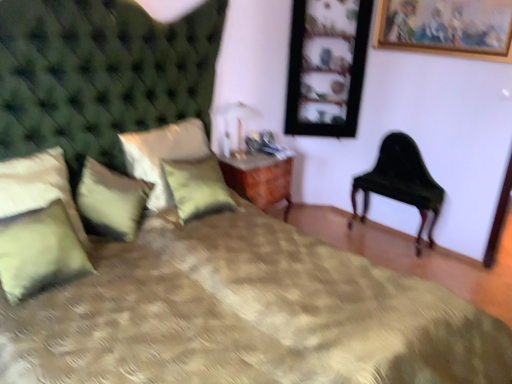
Question: Is gold-framed picture at upper right, the second picture frame when ordered from left to right, next to green textured pillow at center, which appears as the second pillow when viewed from the right, and touching it?

Choices:
 (A) no
 (B) yes

Answer: (A)

Question: Is gold-framed picture at upper right, placed as the first picture frame when sorted from front to back, positioned in front of green textured pillow at center, placed as the 4th pillow when sorted from left to right?

Choices:
 (A) no
 (B) yes

Answer: (A)

Question: From a real-world perspective, does gold-framed picture at upper right, the 1th picture frame from the right, stand above green textured pillow at center, placed as the 4th pillow when sorted from left to right?

Choices:
 (A) yes
 (B) no

Answer: (A)

Question: From the image's perspective, is gold-framed picture at upper right, the 1th picture frame from the right, over green textured pillow at center, placed as the 4th pillow when sorted from left to right?

Choices:
 (A) no
 (B) yes

Answer: (B)

Question: Can you confirm if gold-framed picture at upper right, the second picture frame when ordered from left to right, is positioned to the right of green textured pillow at center, which appears as the second pillow when viewed from the right?

Choices:
 (A) yes
 (B) no

Answer: (A)

Question: Considering the relative sizes of gold-framed picture at upper right, placed as the first picture frame when sorted from front to back, and green textured pillow at center, which appears as the second pillow when viewed from the right, in the image provided, is gold-framed picture at upper right, placed as the first picture frame when sorted from front to back, thinner than green textured pillow at center, which appears as the second pillow when viewed from the right,?

Choices:
 (A) yes
 (B) no

Answer: (A)

Question: Is green velvet pillow at left, which is the third pillow from right to left, next to green textured pillow at center, arranged as the 1th pillow when viewed from the right?

Choices:
 (A) yes
 (B) no

Answer: (B)

Question: Is green textured pillow at center, the 5th pillow when ordered from left to right, at the back of green velvet pillow at left, which is the third pillow from right to left?

Choices:
 (A) no
 (B) yes

Answer: (A)

Question: Is green velvet pillow at left, the third pillow positioned from the left, not close to green textured pillow at center, the 5th pillow when ordered from left to right?

Choices:
 (A) no
 (B) yes

Answer: (A)

Question: Is green velvet pillow at left, the third pillow positioned from the left, to the left of green textured pillow at center, the 5th pillow when ordered from left to right, from the viewer's perspective?

Choices:
 (A) yes
 (B) no

Answer: (A)

Question: From a real-world perspective, is green velvet pillow at left, the third pillow positioned from the left, under green textured pillow at center, the 5th pillow when ordered from left to right?

Choices:
 (A) no
 (B) yes

Answer: (B)

Question: From the image's perspective, would you say green velvet pillow at left, the third pillow positioned from the left, is positioned over green textured pillow at center, the 5th pillow when ordered from left to right?

Choices:
 (A) no
 (B) yes

Answer: (A)

Question: Does metallic gold table lamp at upper center lie in front of wooden nightstand at center?

Choices:
 (A) no
 (B) yes

Answer: (B)